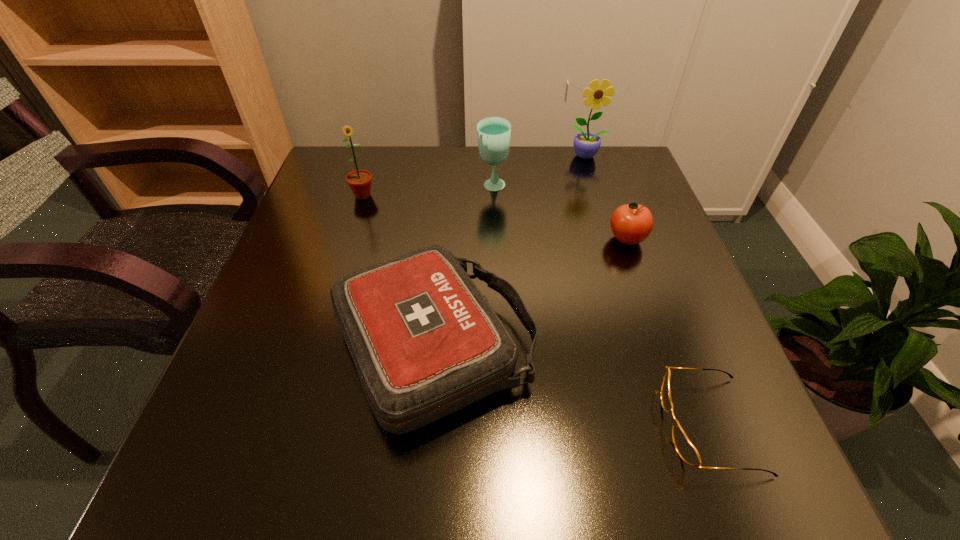
I want to click on the farther sunflower, so click(586, 144).

Where is `the farthest object`? the farthest object is located at coordinates (586, 144).

Identify the location of the nearer sunflower. (359, 181).

This screenshot has width=960, height=540. I want to click on glass, so click(x=493, y=133).

I want to click on apple, so click(631, 223).

Where is `the first-aid kit`? the first-aid kit is located at coordinates (425, 342).

I want to click on the shortest object, so click(686, 450).

Find the location of a particular element. The image size is (960, 540). vacant space positioned on the front-facing side of the right sunflower is located at coordinates (603, 205).

At what (x,y) coordinates should I click in order to perform the action: click on free location located 0.390m on the face of the nearer sunflower. Please return your answer as a coordinate pair (x, y). Image resolution: width=960 pixels, height=540 pixels. Looking at the image, I should click on (321, 331).

Image resolution: width=960 pixels, height=540 pixels. Identify the location of vacant region located on the left of the glass. (359, 187).